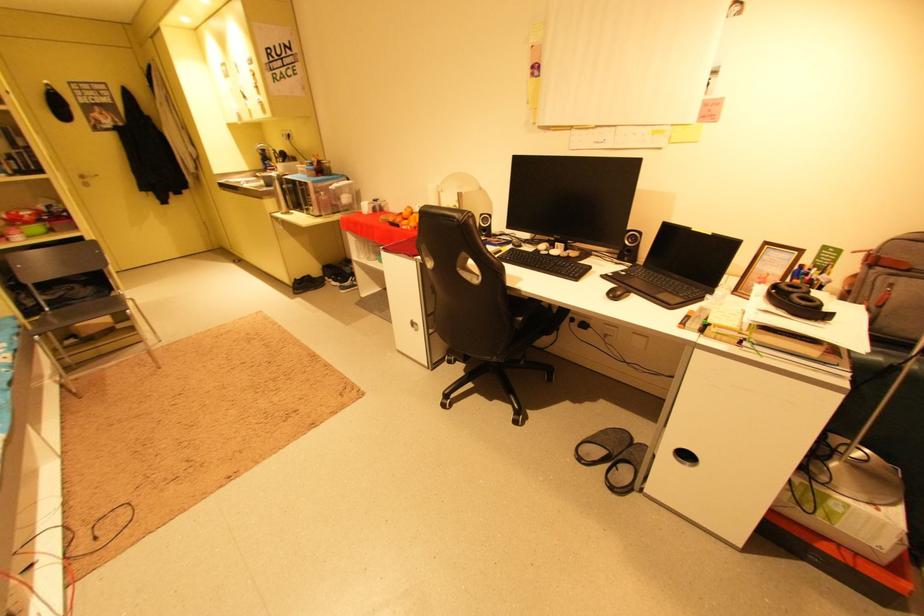
You are a GUI agent. You are given a task and a screenshot of the screen. Output one action in this format:
    pyautogui.click(x=<x>, y=<y>)
    Task: Click on the small black speaker
    The image size is (924, 616).
    Given the screenshot: What is the action you would take?
    pyautogui.click(x=629, y=246)